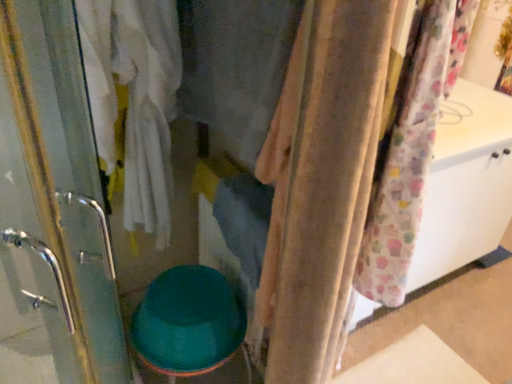
The image size is (512, 384). Identify the location of beige fabric curtain at center. (326, 186).

What do you see at coordinates (234, 67) in the screenshot? Image resolution: width=512 pixels, height=384 pixels. I see `velvet fabric at center` at bounding box center [234, 67].

Where is `teal glossy toilet bowl at center`? Image resolution: width=512 pixels, height=384 pixels. teal glossy toilet bowl at center is located at coordinates (188, 322).

Choose the correct answer: Is teal glossy toilet bowl at center inside velvet fabric at center or outside it?

teal glossy toilet bowl at center lies outside velvet fabric at center.

Is teal glossy toilet bowl at center in front of or behind velvet fabric at center in the image?

Clearly, teal glossy toilet bowl at center is behind velvet fabric at center.

Does point (218, 363) come farther from viewer compared to point (214, 88)?

Yes, point (218, 363) is behind point (214, 88).

From the image's perspective, does teal glossy toilet bowl at center appear lower than velvet fabric at center?

Yes, from the image's perspective, teal glossy toilet bowl at center is beneath velvet fabric at center.

Considering the sizes of objects teal glossy toilet bowl at center and beige fabric curtain at center in the image provided, who is bigger, teal glossy toilet bowl at center or beige fabric curtain at center?

Bigger between the two is teal glossy toilet bowl at center.

From the image's perspective, is teal glossy toilet bowl at center positioned above or below beige fabric curtain at center?

teal glossy toilet bowl at center is situated lower than beige fabric curtain at center in the image.

Could you tell me if teal glossy toilet bowl at center is facing beige fabric curtain at center?

No.

Considering the relative positions of velvet fabric at center and teal glossy toilet bowl at center in the image provided, is velvet fabric at center to the right of teal glossy toilet bowl at center from the viewer's perspective?

Yes, velvet fabric at center is to the right of teal glossy toilet bowl at center.

From a real-world perspective, which is physically below, velvet fabric at center or teal glossy toilet bowl at center?

From a 3D spatial view, teal glossy toilet bowl at center is below.

From the image's perspective, is velvet fabric at center above teal glossy toilet bowl at center?

Yes, from the image's perspective, velvet fabric at center is over teal glossy toilet bowl at center.

Between velvet fabric at center and teal glossy toilet bowl at center, which one has larger size?

teal glossy toilet bowl at center is bigger.

Is beige fabric curtain at center aimed at velvet fabric at center?

No, beige fabric curtain at center is not facing towards velvet fabric at center.

Is beige fabric curtain at center further to the viewer compared to velvet fabric at center?

No, beige fabric curtain at center is in front of velvet fabric at center.

From a real-world perspective, is beige fabric curtain at center physically below velvet fabric at center?

Yes, from a real-world perspective, beige fabric curtain at center is beneath velvet fabric at center.

How distant is beige fabric curtain at center from velvet fabric at center?

beige fabric curtain at center is 11.44 inches away from velvet fabric at center.

Is velvet fabric at center wider or thinner than beige fabric curtain at center?

In the image, velvet fabric at center appears to be more narrow than beige fabric curtain at center.

Which of these two, velvet fabric at center or beige fabric curtain at center, is smaller?

With smaller size is velvet fabric at center.

From the image's perspective, which one is positioned higher, velvet fabric at center or beige fabric curtain at center?

velvet fabric at center.

From a real-world perspective, between velvet fabric at center and beige fabric curtain at center, who is vertically higher?

velvet fabric at center is physically above.

Is beige fabric curtain at center located outside teal glossy toilet bowl at center?

beige fabric curtain at center is positioned outside teal glossy toilet bowl at center.

Considering the relative sizes of beige fabric curtain at center and teal glossy toilet bowl at center in the image provided, is beige fabric curtain at center wider than teal glossy toilet bowl at center?

Incorrect, the width of beige fabric curtain at center does not surpass that of teal glossy toilet bowl at center.

Which object is positioned more to the right, beige fabric curtain at center or teal glossy toilet bowl at center?

Positioned to the right is beige fabric curtain at center.

Find the location of a particular element. clothing on the right of teal glossy toilet bowl at center is located at coordinates (234, 67).

I want to click on curtain that appears in front of the teal glossy toilet bowl at center, so click(x=326, y=186).

Considering their positions, is velvet fabric at center positioned closer to teal glossy toilet bowl at center than beige fabric curtain at center?

The object closer to teal glossy toilet bowl at center is beige fabric curtain at center.

Which object lies nearer to the anchor point teal glossy toilet bowl at center, beige fabric curtain at center or velvet fabric at center?

beige fabric curtain at center.

When comparing their distances from beige fabric curtain at center, does teal glossy toilet bowl at center or velvet fabric at center seem closer?

velvet fabric at center is positioned closer to the anchor beige fabric curtain at center.

In the scene shown: From the image, which object appears to be farther from velvet fabric at center, beige fabric curtain at center or teal glossy toilet bowl at center?

teal glossy toilet bowl at center is positioned further to the anchor velvet fabric at center.

Looking at the image, which one is located further to velvet fabric at center, teal glossy toilet bowl at center or beige fabric curtain at center?

teal glossy toilet bowl at center.

Looking at the image, which one is located further to beige fabric curtain at center, velvet fabric at center or teal glossy toilet bowl at center?

teal glossy toilet bowl at center lies further to beige fabric curtain at center than the other object.

Locate an element on the screen. curtain between velvet fabric at center and teal glossy toilet bowl at center from top to bottom is located at coordinates (326, 186).